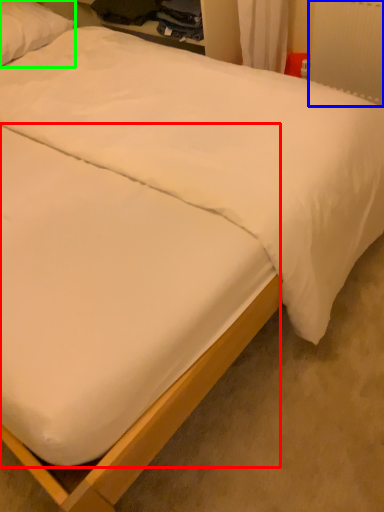
Question: Estimate the real-world distances between objects in this image. Which object is closer to mattress (highlighted by a red box), radiator (highlighted by a blue box) or pillow (highlighted by a green box)?

Choices:
 (A) radiator
 (B) pillow

Answer: (A)